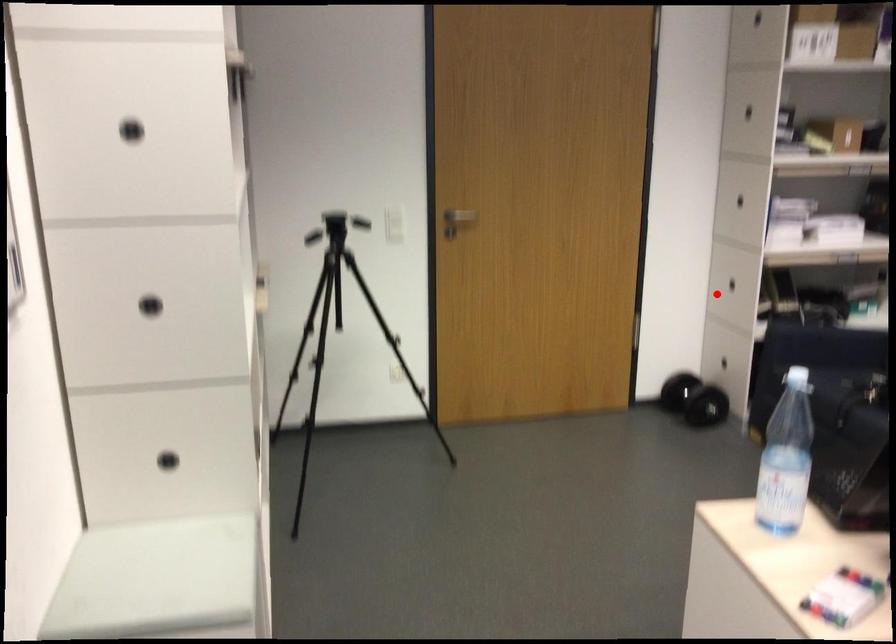
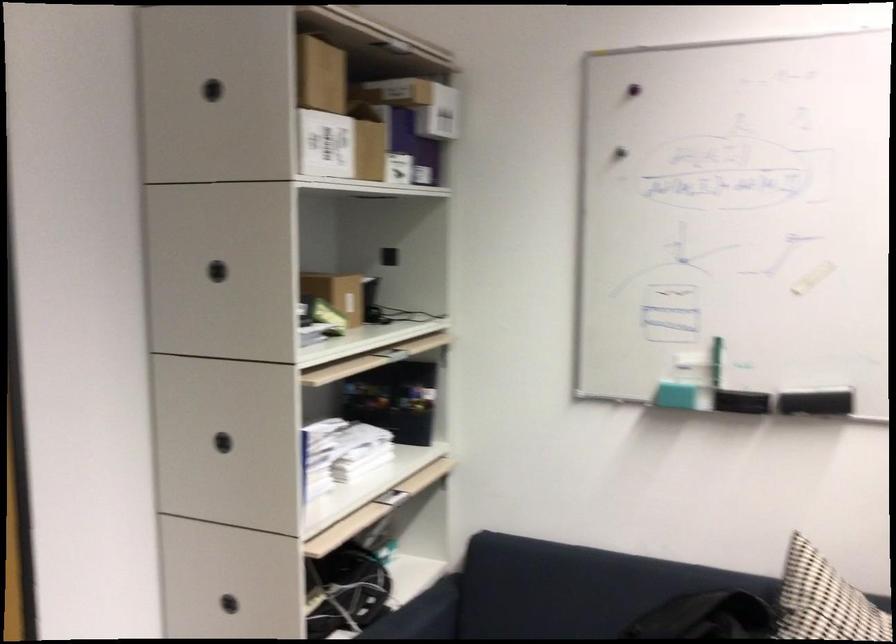
Question: I am providing you with two images of the same scene from different viewpoints. A red point is marked on the first image. At the location where the point appears in image 1, is it still visible in image 2?

Choices:
 (A) Yes
 (B) No

Answer: (A)